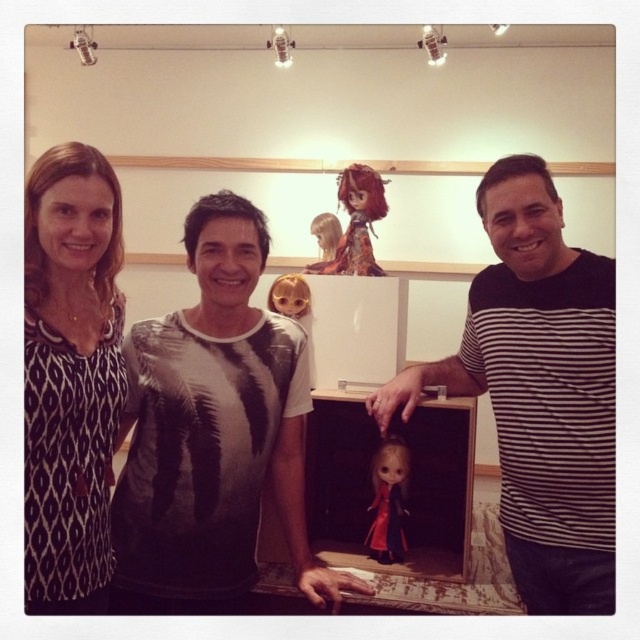
You are a photographer adjusting your camera settings. You need to focus on the matte black doll at center without the black striped shirt at right blocking the view. Is the doll visible through the shirt?

The black striped shirt at right is positioned over matte black doll at center, so the doll is blocked by the shirt and not visible through it.

You are a photographer trying to capture a closeup of both the shiny brown hair doll at upper center and the shiny golden doll at upper center. Given that your camera can only focus on objects within a 25 inch range, will you be able to capture both dolls in one shot?

The distance between the shiny brown hair doll at upper center and the shiny golden doll at upper center is 30.66 inches. Since the camera can only focus within a 25 inch range, the dolls are too far apart to be captured in one shot.